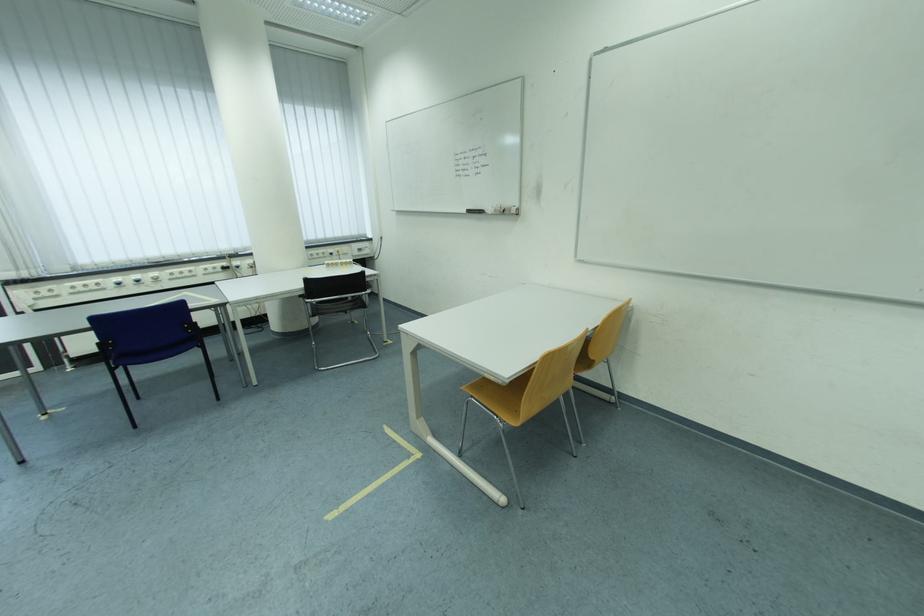
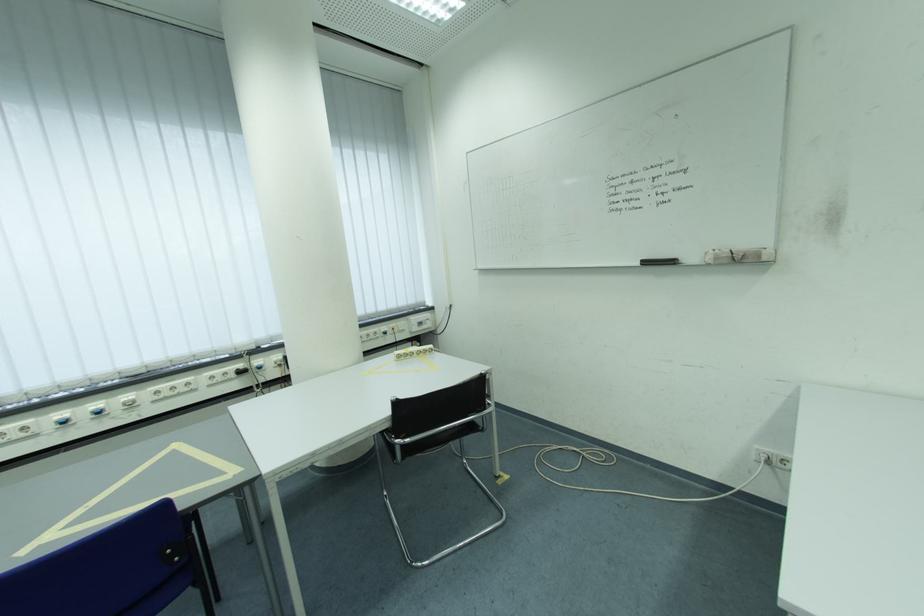
What movement of the cameraman would produce the second image?

The cameraman walked toward left, forward.